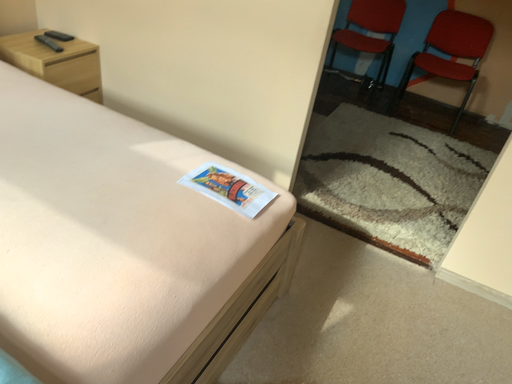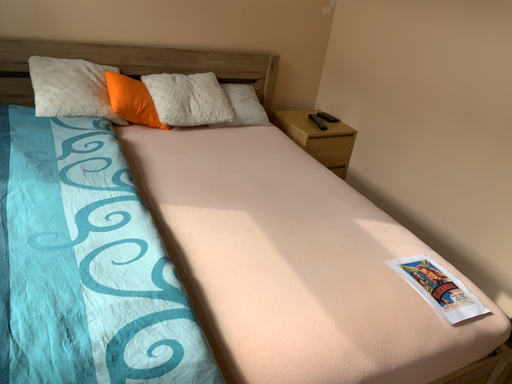
Question: How did the camera likely rotate when shooting the video?

Choices:
 (A) rotated upward
 (B) rotated downward

Answer: (A)